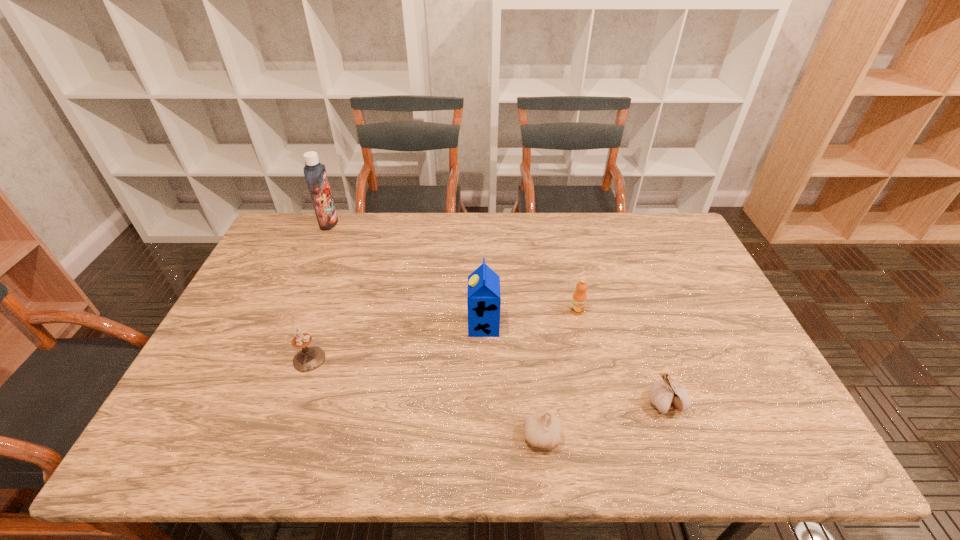
Image resolution: width=960 pixels, height=540 pixels. Identify the location of free space that satisfies the following two spatial constraints: 1. on the front label of the taller garlic; 2. on the left side of the second object from right to left. (598, 403).

The width and height of the screenshot is (960, 540). Identify the location of vacant position in the image that satisfies the following two spatial constraints: 1. with the cap open on the left garlic; 2. on the right side of the second tallest object. (485, 436).

Locate an element on the screen. The image size is (960, 540). free space that satisfies the following two spatial constraints: 1. with the cap open on the farther garlic; 2. on the right side of the carton is located at coordinates click(484, 403).

Where is `free region that satisfies the following two spatial constraints: 1. on the back side of the farther garlic; 2. on the right side of the shortest object`? This screenshot has width=960, height=540. free region that satisfies the following two spatial constraints: 1. on the back side of the farther garlic; 2. on the right side of the shortest object is located at coordinates (539, 403).

Where is `free location that satisfies the following two spatial constraints: 1. with the cap open on the fifth shortest object; 2. on the left side of the right garlic`? This screenshot has height=540, width=960. free location that satisfies the following two spatial constraints: 1. with the cap open on the fifth shortest object; 2. on the left side of the right garlic is located at coordinates (484, 403).

Where is `free spot that satisfies the following two spatial constraints: 1. with the cap open on the carton; 2. on the back side of the nearest object`? Image resolution: width=960 pixels, height=540 pixels. free spot that satisfies the following two spatial constraints: 1. with the cap open on the carton; 2. on the back side of the nearest object is located at coordinates (485, 436).

This screenshot has width=960, height=540. In order to click on vacant space that satisfies the following two spatial constraints: 1. on the front side of the candle holder; 2. on the right side of the left garlic in this screenshot , I will do `click(281, 436)`.

Identify the location of blank space that satisfies the following two spatial constraints: 1. with the cap open on the shorter garlic; 2. on the right side of the fourth object from right to left. This screenshot has width=960, height=540. (485, 436).

Locate an element on the screen. vacant space that satisfies the following two spatial constraints: 1. with the cap open on the third object from left to right; 2. on the right side of the rightmost object is located at coordinates (484, 403).